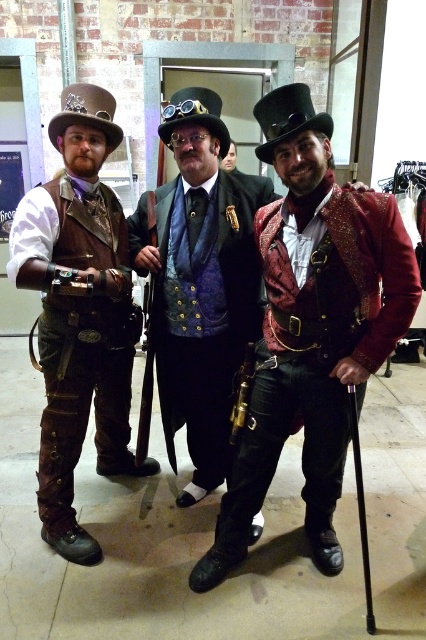
Question: Which object appears closest to the camera in this image?

Choices:
 (A) velvet blue vest at center
 (B) shiny red velvet jacket at center

Answer: (B)

Question: Does shiny red velvet jacket at center have a smaller size compared to velvet blue vest at center?

Choices:
 (A) no
 (B) yes

Answer: (A)

Question: From the image, what is the correct spatial relationship of shiny red velvet jacket at center in relation to leather vest at left?

Choices:
 (A) below
 (B) above

Answer: (A)

Question: Among these points, which one is farthest from the camera?

Choices:
 (A) (339, 477)
 (B) (94, 132)
 (C) (169, 196)

Answer: (C)

Question: Can you confirm if shiny red velvet jacket at center is positioned to the left of velvet blue vest at center?

Choices:
 (A) no
 (B) yes

Answer: (A)

Question: Which of these objects is positioned farthest from the shiny red velvet jacket at center?

Choices:
 (A) velvet blue vest at center
 (B) leather vest at left

Answer: (B)